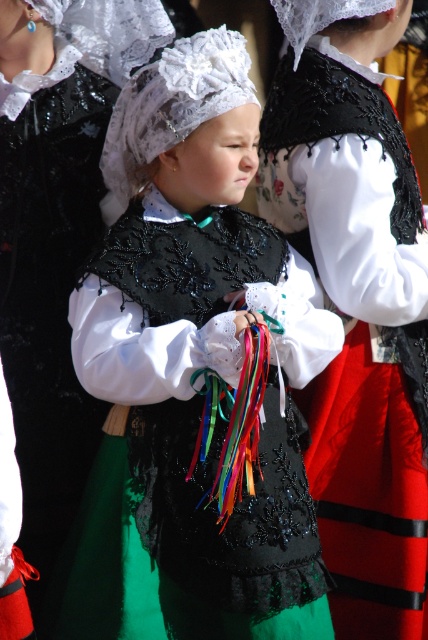
From the picture: Is matte black vest at center to the left of black lace vest at center from the viewer's perspective?

Indeed, matte black vest at center is positioned on the left side of black lace vest at center.

Does point (240, 109) come behind point (359, 544)?

That is False.

The height and width of the screenshot is (640, 428). I want to click on matte black vest at center, so click(x=199, y=358).

Is matte black vest at center smaller than matte black dress at center?

Actually, matte black vest at center might be larger than matte black dress at center.

Who is positioned more to the right, matte black vest at center or matte black dress at center?

matte black vest at center

Identify the location of matte black vest at center. This screenshot has width=428, height=640. (199, 358).

You are a GUI agent. You are given a task and a screenshot of the screen. Output one action in this format:
    pyautogui.click(x=<x>, y=<y>)
    Task: Click on the matte black vest at center
    
    Given the screenshot: What is the action you would take?
    pyautogui.click(x=199, y=358)

Does black lace vest at center appear on the left side of matte black dress at center?

Incorrect, black lace vest at center is not on the left side of matte black dress at center.

Is black lace vest at center below matte black dress at center?

Indeed, black lace vest at center is positioned under matte black dress at center.

Is point (335, 200) farther from camera compared to point (41, 140)?

No, (335, 200) is closer to viewer.

Image resolution: width=428 pixels, height=640 pixels. I want to click on black lace vest at center, so tap(357, 328).